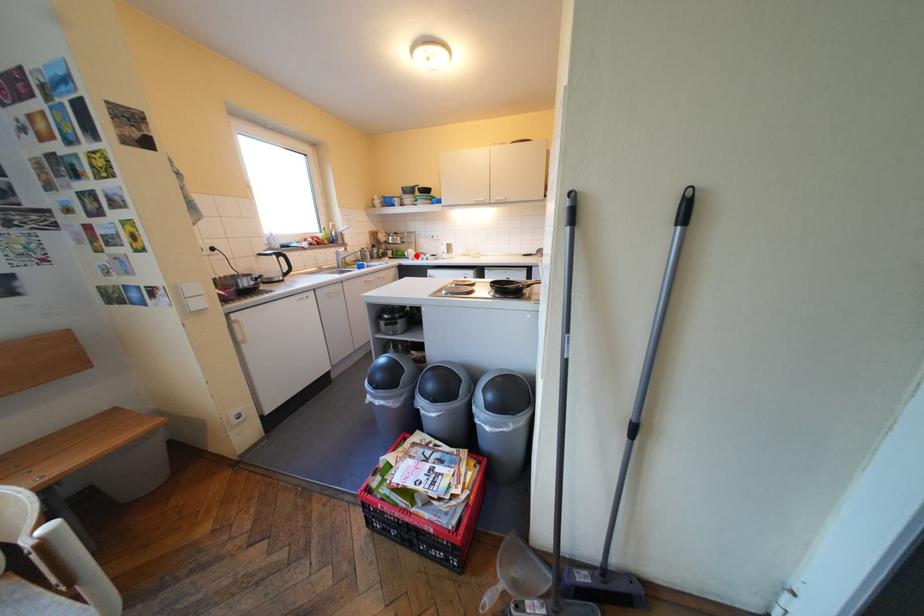
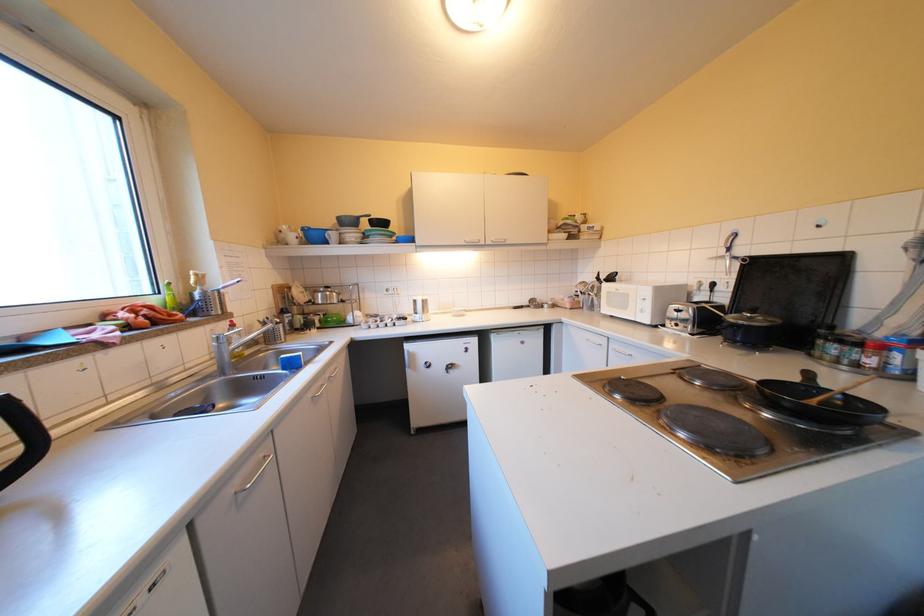
The point at the highlighted location is marked in the first image. Where is the corresponding point in the second image?

(356, 323)